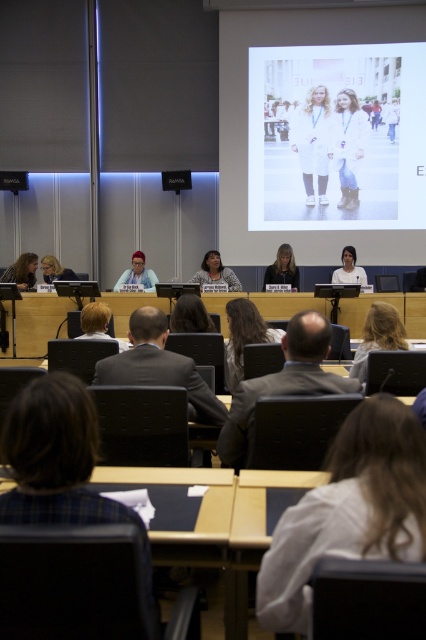
Does white fabric at upper center have a lesser width compared to matte black laptop at center?

No, white fabric at upper center is not thinner than matte black laptop at center.

How distant is white fabric at upper center from matte black laptop at center?

white fabric at upper center and matte black laptop at center are 6.73 feet apart.

Is point (368, 202) positioned before point (279, 276)?

That is False.

Where is `white fabric at upper center`? The width and height of the screenshot is (426, 640). white fabric at upper center is located at coordinates (336, 136).

Can you confirm if white fabric shirt at lower right is shorter than white fabric shirt at center?

Indeed, white fabric shirt at lower right has a lesser height compared to white fabric shirt at center.

Between white fabric shirt at lower right and white fabric shirt at center, which one has less height?

Standing shorter between the two is white fabric shirt at lower right.

Is point (285, 560) closer to camera compared to point (345, 275)?

That is True.

The width and height of the screenshot is (426, 640). In order to click on white fabric shirt at lower right in this screenshot , I will do `click(350, 509)`.

Which is behind, point (391, 330) or point (138, 276)?

Positioned behind is point (138, 276).

Who is shorter, blonde hair at center or matte gray suit at center?

Standing shorter between the two is blonde hair at center.

Identify the location of blonde hair at center. Image resolution: width=426 pixels, height=640 pixels. (377, 337).